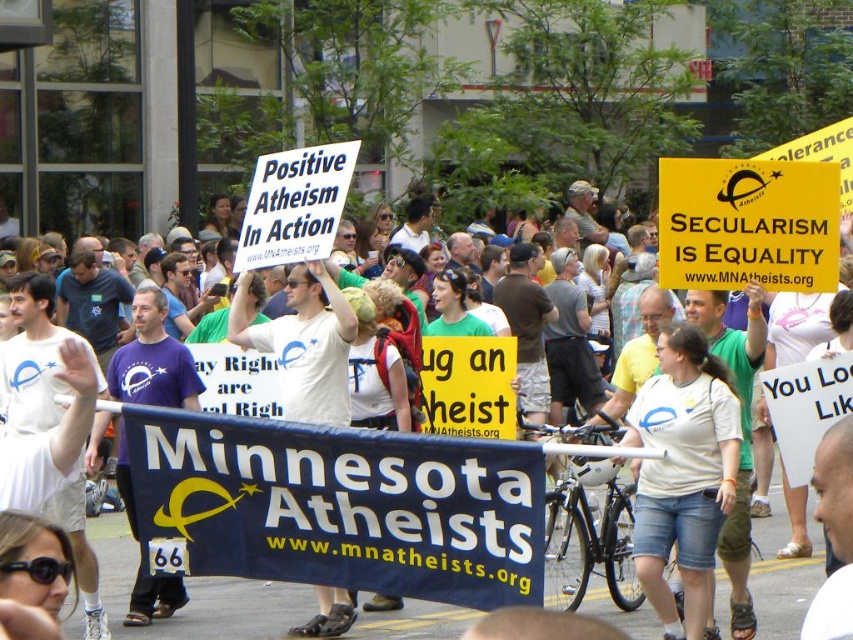
Does white matte t-shirt at center have a larger size compared to yellow paper sign at center?

Incorrect, white matte t-shirt at center is not larger than yellow paper sign at center.

Locate an element on the screen. The image size is (853, 640). white matte t-shirt at center is located at coordinates (682, 474).

Is yellow paper sign at center taller than white paper sign at upper center?

Yes.

Is the position of yellow paper sign at center more distant than that of white paper sign at upper center?

No, it is in front of white paper sign at upper center.

Locate an element on the screen. yellow paper sign at center is located at coordinates (747, 224).

Image resolution: width=853 pixels, height=640 pixels. I want to click on yellow paper sign at center, so click(747, 224).

Does white matte t-shirt at center appear on the right side of white paper sign at upper center?

Correct, you'll find white matte t-shirt at center to the right of white paper sign at upper center.

Does white matte t-shirt at center have a greater width compared to white paper sign at upper center?

In fact, white matte t-shirt at center might be narrower than white paper sign at upper center.

Is point (695, 378) closer to camera compared to point (343, 186)?

Yes, it is.

Where is `white matte t-shirt at center`? This screenshot has height=640, width=853. white matte t-shirt at center is located at coordinates (682, 474).